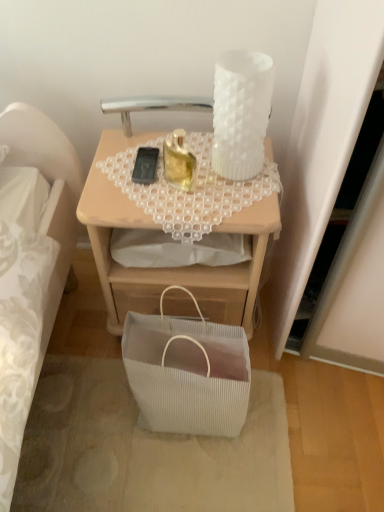
This screenshot has height=512, width=384. What do you see at coordinates (169, 268) in the screenshot? I see `matte wooden desk at center` at bounding box center [169, 268].

Measure the distance between translucent glass candle at upper center, arranged as the second candle holder when viewed from the right, and camera.

90.00 centimeters.

Find the location of a particular element. translucent glass candle at upper center, arranged as the second candle holder when viewed from the right is located at coordinates (179, 161).

Describe the element at coordinates (187, 372) in the screenshot. I see `white ribbed fabric bag at lower center` at that location.

Identify the location of matte wooden desk at center. The height and width of the screenshot is (512, 384). (169, 268).

Is point (137, 180) farther from camera compared to point (177, 167)?

That is False.

From the black matte mobile phone at center, count 1st candle holders forward and point to it. Please provide its 2D coordinates.

[(179, 161)]

Considering the relative sizes of black matte mobile phone at center and translucent glass candle at upper center, arranged as the second candle holder when viewed from the right, in the image provided, is black matte mobile phone at center smaller than translucent glass candle at upper center, arranged as the second candle holder when viewed from the right,?

Yes.

Is black matte mobile phone at center shorter than translucent glass candle at upper center, arranged as the second candle holder when viewed from the right?

Correct, black matte mobile phone at center is not as tall as translucent glass candle at upper center, arranged as the second candle holder when viewed from the right.

Considering the relative sizes of matte wooden desk at center and translucent glass candle at upper center, arranged as the first candle holder when viewed from the left, in the image provided, is matte wooden desk at center wider than translucent glass candle at upper center, arranged as the first candle holder when viewed from the left,?

Correct, the width of matte wooden desk at center exceeds that of translucent glass candle at upper center, arranged as the first candle holder when viewed from the left.

Is matte wooden desk at center to the right of translucent glass candle at upper center, arranged as the second candle holder when viewed from the right, from the viewer's perspective?

Yes, matte wooden desk at center is to the right of translucent glass candle at upper center, arranged as the second candle holder when viewed from the right.

Would you consider matte wooden desk at center to be distant from translucent glass candle at upper center, arranged as the first candle holder when viewed from the left?

No.

From a real-world perspective, is matte wooden desk at center beneath translucent glass candle at upper center, arranged as the first candle holder when viewed from the left?

Indeed, from a real-world perspective, matte wooden desk at center is positioned beneath translucent glass candle at upper center, arranged as the first candle holder when viewed from the left.

Is white ribbed fabric bag at lower center inside or outside of white frosted glass candle holder at upper right, which appears as the 1th candle holder when viewed from the right?

white ribbed fabric bag at lower center is not inside white frosted glass candle holder at upper right, which appears as the 1th candle holder when viewed from the right, it's outside.

Does white ribbed fabric bag at lower center turn towards white frosted glass candle holder at upper right, which appears as the 1th candle holder when viewed from the right?

No.

Is white ribbed fabric bag at lower center smaller than white frosted glass candle holder at upper right, the 2th candle holder from the left?

No, white ribbed fabric bag at lower center is not smaller than white frosted glass candle holder at upper right, the 2th candle holder from the left.

Considering the relative positions of white ribbed fabric bag at lower center and white frosted glass candle holder at upper right, the 2th candle holder from the left, in the image provided, is white ribbed fabric bag at lower center to the right of white frosted glass candle holder at upper right, the 2th candle holder from the left, from the viewer's perspective?

Incorrect, white ribbed fabric bag at lower center is not on the right side of white frosted glass candle holder at upper right, the 2th candle holder from the left.

Looking at this image, could you tell me if translucent glass candle at upper center, arranged as the first candle holder when viewed from the left, is facing matte wooden desk at center?

No, translucent glass candle at upper center, arranged as the first candle holder when viewed from the left, is not oriented towards matte wooden desk at center.

Between translucent glass candle at upper center, arranged as the second candle holder when viewed from the right, and matte wooden desk at center, which one appears on the right side from the viewer's perspective?

Positioned to the right is matte wooden desk at center.

Between translucent glass candle at upper center, arranged as the second candle holder when viewed from the right, and matte wooden desk at center, which one has larger size?

matte wooden desk at center.

This screenshot has height=512, width=384. There is a matte wooden desk at center. What are the coordinates of `the 1st candle holder above it (from a real-world perspective)` in the screenshot? It's located at (179, 161).

Considering the relative sizes of translucent glass candle at upper center, arranged as the first candle holder when viewed from the left, and white ribbed fabric bag at lower center in the image provided, is translucent glass candle at upper center, arranged as the first candle holder when viewed from the left, smaller than white ribbed fabric bag at lower center?

Yes, translucent glass candle at upper center, arranged as the first candle holder when viewed from the left, is smaller than white ribbed fabric bag at lower center.

Considering the positions of objects translucent glass candle at upper center, arranged as the second candle holder when viewed from the right, and white ribbed fabric bag at lower center in the image provided, who is more to the left, translucent glass candle at upper center, arranged as the second candle holder when viewed from the right, or white ribbed fabric bag at lower center?

translucent glass candle at upper center, arranged as the second candle holder when viewed from the right, is more to the left.

From a real-world perspective, who is located higher, translucent glass candle at upper center, arranged as the second candle holder when viewed from the right, or white ribbed fabric bag at lower center?

translucent glass candle at upper center, arranged as the second candle holder when viewed from the right.

From the image's perspective, which is below, translucent glass candle at upper center, arranged as the first candle holder when viewed from the left, or white ribbed fabric bag at lower center?

white ribbed fabric bag at lower center is shown below in the image.

Is matte wooden desk at center taller than black matte mobile phone at center?

Yes.

Between point (250, 210) and point (152, 168), which one is positioned in front?

Point (250, 210)

Is matte wooden desk at center bigger than black matte mobile phone at center?

Correct, matte wooden desk at center is larger in size than black matte mobile phone at center.

Is matte wooden desk at center in front of or behind black matte mobile phone at center in the image?

Clearly, matte wooden desk at center is in front of black matte mobile phone at center.

Which is closer to the camera, (228, 124) or (185, 173)?

Point (228, 124) is closer to the camera than point (185, 173).

Find the location of `candle holder behind the white frosted glass candle holder at upper right, which appears as the 1th candle holder when viewed from the right`. candle holder behind the white frosted glass candle holder at upper right, which appears as the 1th candle holder when viewed from the right is located at coordinates (179, 161).

From the image's perspective, between white frosted glass candle holder at upper right, which appears as the 1th candle holder when viewed from the right, and translucent glass candle at upper center, arranged as the first candle holder when viewed from the left, which one is located above?

white frosted glass candle holder at upper right, which appears as the 1th candle holder when viewed from the right, is shown above in the image.

Consider the image. Measure the distance from white frosted glass candle holder at upper right, the 2th candle holder from the left, to translucent glass candle at upper center, arranged as the first candle holder when viewed from the left.

The distance of white frosted glass candle holder at upper right, the 2th candle holder from the left, from translucent glass candle at upper center, arranged as the first candle holder when viewed from the left, is 6.02 inches.

At what (x,y) coordinates should I click in order to perform the action: click on mobile phone that is under the translucent glass candle at upper center, arranged as the second candle holder when viewed from the right (from a real-world perspective). Please return your answer as a coordinate pair (x, y). Image resolution: width=384 pixels, height=512 pixels. Looking at the image, I should click on (145, 165).

From a real-world perspective, starting from the matte wooden desk at center, which candle holder is the 1st one vertically above it? Please provide its 2D coordinates.

[(179, 161)]

Looking at the image, which one is located further to white frosted glass candle holder at upper right, the 2th candle holder from the left, black matte mobile phone at center or matte wooden desk at center?

matte wooden desk at center.

In the scene shown: When comparing their distances from white ribbed fabric bag at lower center, does white frosted glass candle holder at upper right, the 2th candle holder from the left, or black matte mobile phone at center seem further?

white frosted glass candle holder at upper right, the 2th candle holder from the left, lies further to white ribbed fabric bag at lower center than the other object.

Looking at this image, considering their positions, is translucent glass candle at upper center, arranged as the first candle holder when viewed from the left, positioned further to matte wooden desk at center than white frosted glass candle holder at upper right, which appears as the 1th candle holder when viewed from the right?

white frosted glass candle holder at upper right, which appears as the 1th candle holder when viewed from the right.

From the image, which object appears to be nearer to black matte mobile phone at center, translucent glass candle at upper center, arranged as the first candle holder when viewed from the left, or white ribbed fabric bag at lower center?

translucent glass candle at upper center, arranged as the first candle holder when viewed from the left.

Based on their spatial positions, is matte wooden desk at center or white ribbed fabric bag at lower center closer to white frosted glass candle holder at upper right, which appears as the 1th candle holder when viewed from the right?

Among the two, matte wooden desk at center is located nearer to white frosted glass candle holder at upper right, which appears as the 1th candle holder when viewed from the right.

In the scene shown: When comparing their distances from matte wooden desk at center, does white frosted glass candle holder at upper right, which appears as the 1th candle holder when viewed from the right, or black matte mobile phone at center seem closer?

black matte mobile phone at center lies closer to matte wooden desk at center than the other object.

Estimate the real-world distances between objects in this image. Which object is further from translucent glass candle at upper center, arranged as the first candle holder when viewed from the left, black matte mobile phone at center or matte wooden desk at center?

matte wooden desk at center lies further to translucent glass candle at upper center, arranged as the first candle holder when viewed from the left, than the other object.

Which object lies further to the anchor point translucent glass candle at upper center, arranged as the second candle holder when viewed from the right, white frosted glass candle holder at upper right, the 2th candle holder from the left, or white ribbed fabric bag at lower center?

white ribbed fabric bag at lower center lies further to translucent glass candle at upper center, arranged as the second candle holder when viewed from the right, than the other object.

This screenshot has width=384, height=512. I want to click on candle holder between black matte mobile phone at center and matte wooden desk at center in the up-down direction, so click(179, 161).

At what (x,y) coordinates should I click in order to perform the action: click on desk between white frosted glass candle holder at upper right, which appears as the 1th candle holder when viewed from the right, and white ribbed fabric bag at lower center in the up-down direction. Please return your answer as a coordinate pair (x, y). The width and height of the screenshot is (384, 512). Looking at the image, I should click on (169, 268).

Image resolution: width=384 pixels, height=512 pixels. I want to click on candle holder between black matte mobile phone at center and white ribbed fabric bag at lower center in the vertical direction, so click(179, 161).

Where is `candle holder that lies between white frosted glass candle holder at upper right, which appears as the 1th candle holder when viewed from the right, and matte wooden desk at center from top to bottom`? This screenshot has height=512, width=384. candle holder that lies between white frosted glass candle holder at upper right, which appears as the 1th candle holder when viewed from the right, and matte wooden desk at center from top to bottom is located at coordinates (179, 161).